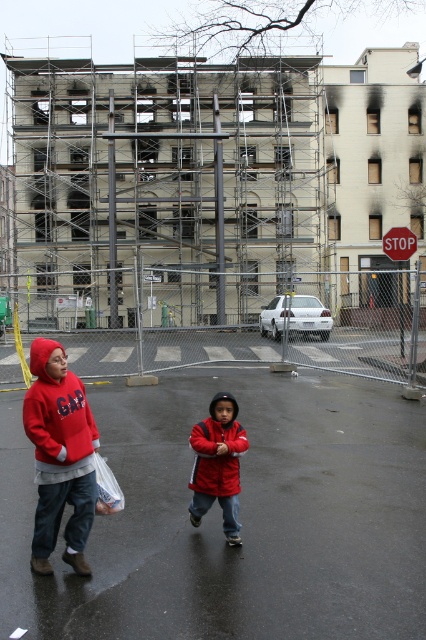
Can you confirm if matte red hoodie at center is positioned below red plastic stop sign at center?

Yes, matte red hoodie at center is below red plastic stop sign at center.

Does point (37, 339) come in front of point (411, 241)?

Yes, point (37, 339) is in front of point (411, 241).

The width and height of the screenshot is (426, 640). I want to click on matte red hoodie at center, so click(60, 456).

How distant is white plastic bag at lower left from red plastic stop sign at center?

white plastic bag at lower left is 40.24 feet from red plastic stop sign at center.

Can you confirm if white plastic bag at lower left is thinner than red plastic stop sign at center?

Correct, white plastic bag at lower left's width is less than red plastic stop sign at center's.

Which is behind, point (115, 490) or point (412, 246)?

The point (412, 246) is more distant.

Identify the location of white plastic bag at lower left. This screenshot has width=426, height=640. (106, 486).

Who is shorter, matte red hoodie at center or red matte jacket at center?

Standing shorter between the two is red matte jacket at center.

Is point (34, 516) closer to viewer compared to point (238, 497)?

Yes, it is.

The height and width of the screenshot is (640, 426). What are the coordinates of `matte red hoodie at center` in the screenshot? It's located at (60, 456).